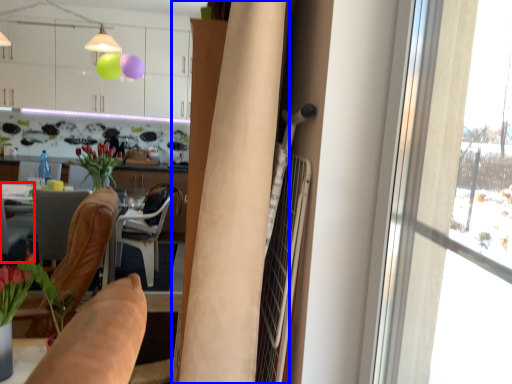
Question: Which object is further to the camera taking this photo, chair (highlighted by a red box) or curtain (highlighted by a blue box)?

Choices:
 (A) chair
 (B) curtain

Answer: (A)